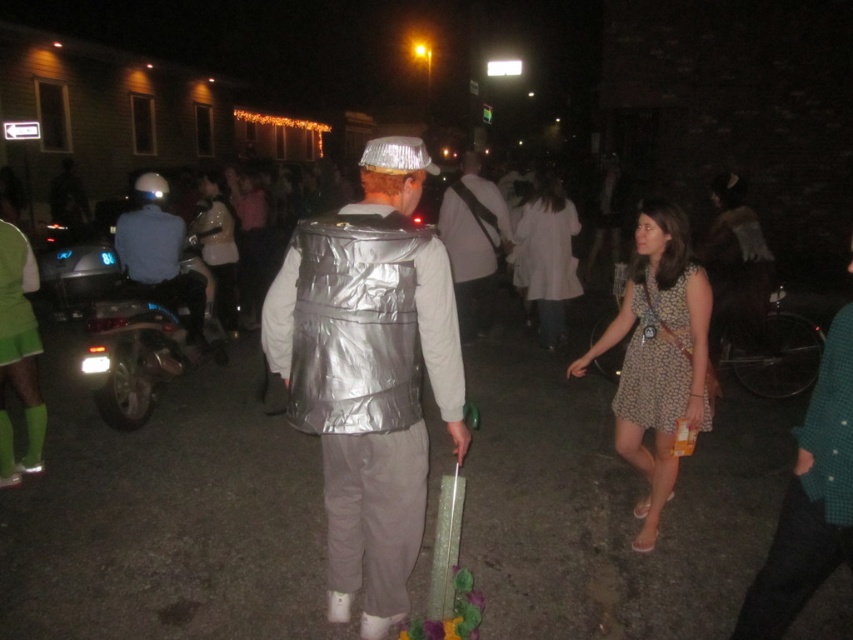
Question: Which of the following is the farthest from the observer?

Choices:
 (A) (639, 289)
 (B) (381, 372)
 (C) (227, 300)

Answer: (C)

Question: Among these objects, which one is farthest from the camera?

Choices:
 (A) shiny metallic vest at center
 (B) white cotton dress at center
 (C) dotted floral fabric dress at lower right
 (D) matte white dress at center

Answer: (D)

Question: Which point is closer to the camera?

Choices:
 (A) (218, 237)
 (B) (480, 214)
 (C) (100, 257)

Answer: (B)

Question: In this image, where is dotted fabric dress at lower right located relative to white cotton dress at center?

Choices:
 (A) left
 (B) right

Answer: (A)

Question: Is dotted fabric dress at lower right wider than white cotton dress at center?

Choices:
 (A) no
 (B) yes

Answer: (B)

Question: Can you confirm if dotted fabric dress at lower right is positioned below brushed metal helmet at left?

Choices:
 (A) yes
 (B) no

Answer: (A)